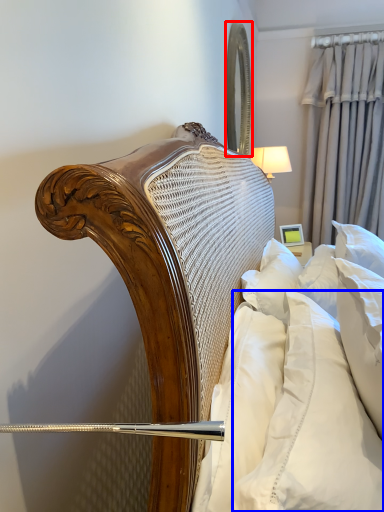
Question: Among these objects, which one is nearest to the camera, mirror (highlighted by a red box) or pillow (highlighted by a blue box)?

Choices:
 (A) mirror
 (B) pillow

Answer: (B)